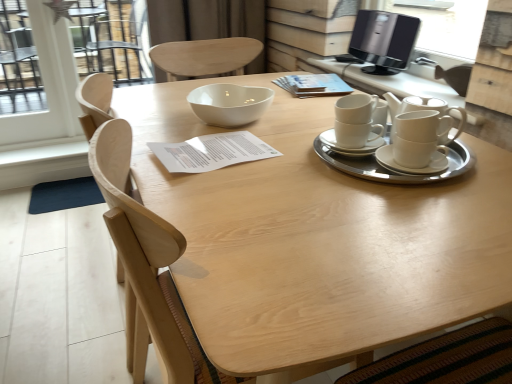
Where is `vacant region to the right of white glossy bowl at center`? This screenshot has height=384, width=512. vacant region to the right of white glossy bowl at center is located at coordinates click(x=306, y=111).